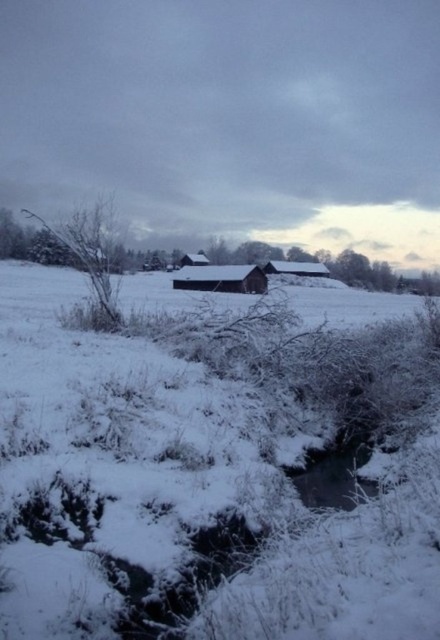
You are a photographer planning to capture the winter landscape. You want to ensure both the wooden barn at center and the brown wooden hut at center are clearly visible in your shot. Given their heights, which structure will appear taller in the photograph?

The brown wooden hut at center appears taller in the photograph because it is taller than the wooden barn at center.

From the picture: You are planning to build a new shed in the winter landscape scene. The wooden barn at center and the brown wooden hut at center are already present. If you want to ensure the shed is wider than both, what should you consider based on their current widths?

The wooden barn at center is wider than the brown wooden hut at center. To build a shed wider than both, it must exceed the width of the wooden barn at center, which is the wider of the two.